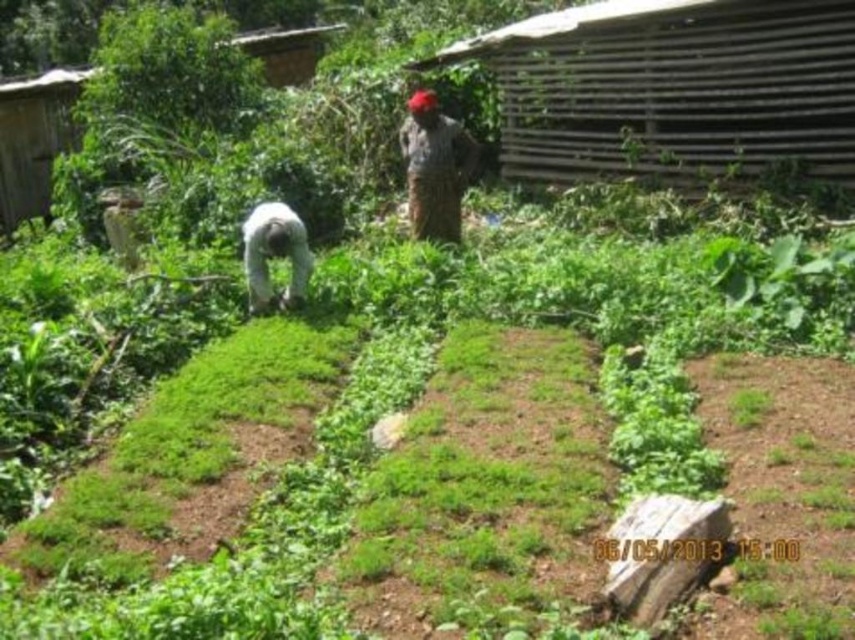
Question: Which of the following is the farthest from the observer?

Choices:
 (A) dark gray fabric at center
 (B) white fabric at center

Answer: (A)

Question: Is dark gray fabric at center above white fabric at center?

Choices:
 (A) yes
 (B) no

Answer: (A)

Question: Among these objects, which one is farthest from the camera?

Choices:
 (A) white fabric at center
 (B) dark gray fabric at center

Answer: (B)

Question: Observing the image, what is the correct spatial positioning of dark gray fabric at center in reference to white fabric at center?

Choices:
 (A) above
 (B) below

Answer: (A)

Question: Is dark gray fabric at center thinner than white fabric at center?

Choices:
 (A) yes
 (B) no

Answer: (B)